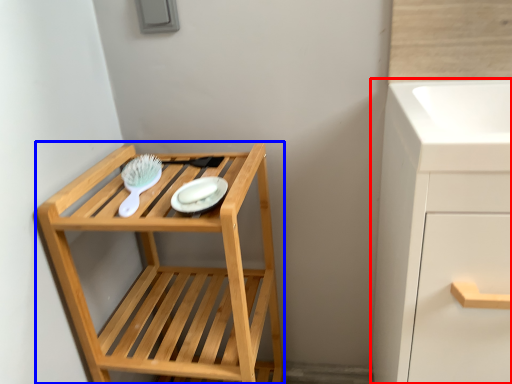
Question: Among these objects, which one is farthest to the camera, bathroom cabinet (highlighted by a red box) or furniture (highlighted by a blue box)?

Choices:
 (A) bathroom cabinet
 (B) furniture

Answer: (B)